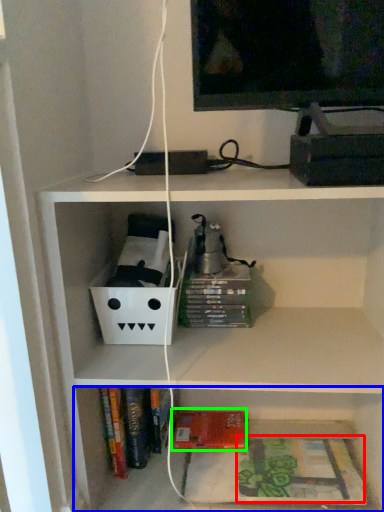
Question: Based on their relative distances, which object is farther from book (highlighted by a red box)? Choose from shelf (highlighted by a blue box) and paperback book (highlighted by a green box).

Choices:
 (A) shelf
 (B) paperback book

Answer: (B)